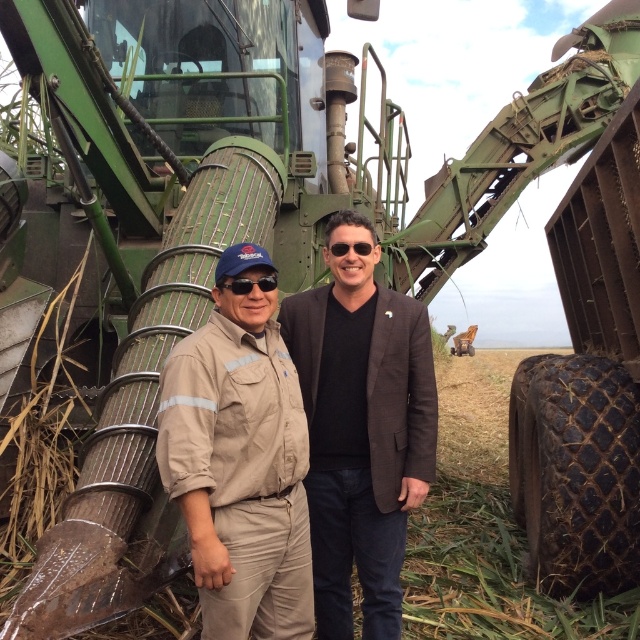
From the picture: Between tan fabric uniform at center and black matte sunglasses at center, which one appears on the left side from the viewer's perspective?

From the viewer's perspective, tan fabric uniform at center appears more on the left side.

Does tan fabric uniform at center have a smaller size compared to black matte sunglasses at center?

Incorrect, tan fabric uniform at center is not smaller in size than black matte sunglasses at center.

Locate an element on the screen. The width and height of the screenshot is (640, 640). tan fabric uniform at center is located at coordinates (240, 461).

Between tan fabric uniform at center and brown fabric suit at center, which one is positioned higher?

brown fabric suit at center is higher up.

The width and height of the screenshot is (640, 640). Describe the element at coordinates (240, 461) in the screenshot. I see `tan fabric uniform at center` at that location.

At what (x,y) coordinates should I click in order to perform the action: click on tan fabric uniform at center. Please return your answer as a coordinate pair (x, y). This screenshot has height=640, width=640. Looking at the image, I should click on (240, 461).

Who is more forward, (390,586) or (230,284)?

Point (230,284) is in front.

Between brown fabric suit at center and black matte sunglasses at center, which one has less height?

black matte sunglasses at center is shorter.

In the scene shown: Who is more distant from viewer, (410, 445) or (259, 278)?

Point (410, 445)

Identify the location of brown fabric suit at center. The height and width of the screenshot is (640, 640). (362, 426).